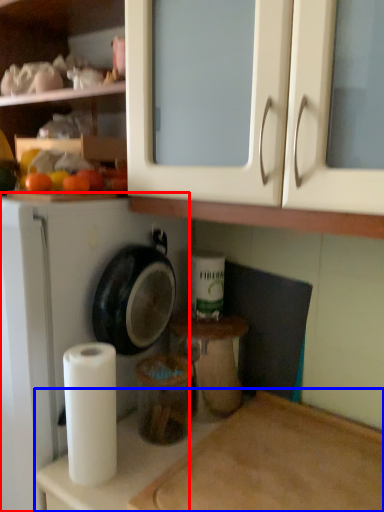
Question: Which object is closer to the camera taking this photo, dish washer (highlighted by a red box) or counter top (highlighted by a blue box)?

Choices:
 (A) dish washer
 (B) counter top

Answer: (B)